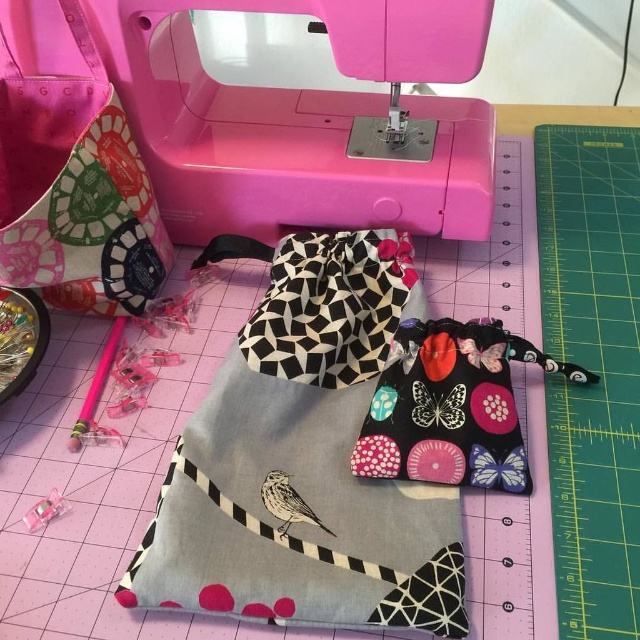
You are a tailor trying to determine which fabric pouch is taller between the multicolored fabric pouch at upper left and the black fabric pouch with butterfly prints at center. Based on the scene, which one is taller?

The multicolored fabric pouch at upper left is much taller than the black fabric pouch with butterfly prints at center.

You are a tailor trying to determine if the pink plastic sewing machine at upper center can fit through a doorway that is the same width as the multicolored fabric pouch at upper left. Based on their widths, can the sewing machine pass through?

The pink plastic sewing machine at upper center is wider than the multicolored fabric pouch at upper left, so it cannot pass through the doorway that is the same width as the pouch.

You are a tailor working on a sewing project. You need to place a button onto the black fabric pouch with butterfly prints at center. The button is currently on the pink plastic sewing machine at upper center. Can you reach the button from your current position without moving the sewing machine?

The pink plastic sewing machine at upper center is to the left of black fabric pouch with butterfly prints at center. Since the button is on the sewing machine, you can easily reach it from your current position without needing to move the machine.